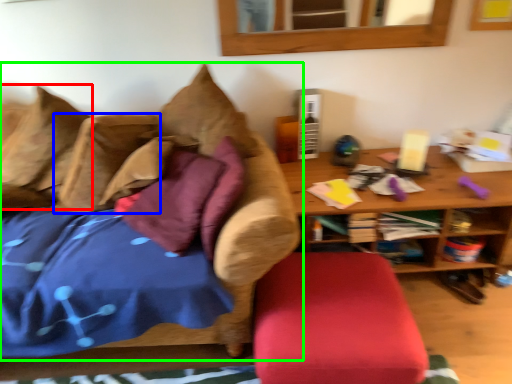
Question: Which is nearer to the pillow (highlighted by a red box)? pillow (highlighted by a blue box) or studio couch (highlighted by a green box).

Choices:
 (A) pillow
 (B) studio couch

Answer: (A)